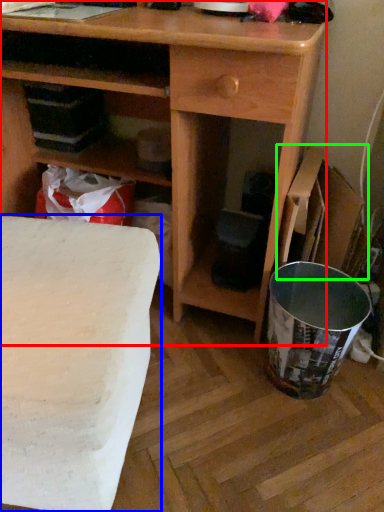
Question: Which object is the closest to the desk (highlighted by a red box)? Choose among these: table (highlighted by a blue box) or cardboard box (highlighted by a green box).

Choices:
 (A) table
 (B) cardboard box

Answer: (B)